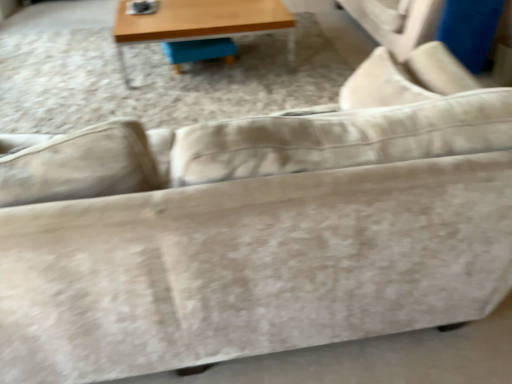
This screenshot has width=512, height=384. Identify the location of vacant region to the left of blue fabric swivel chair at center. (146, 64).